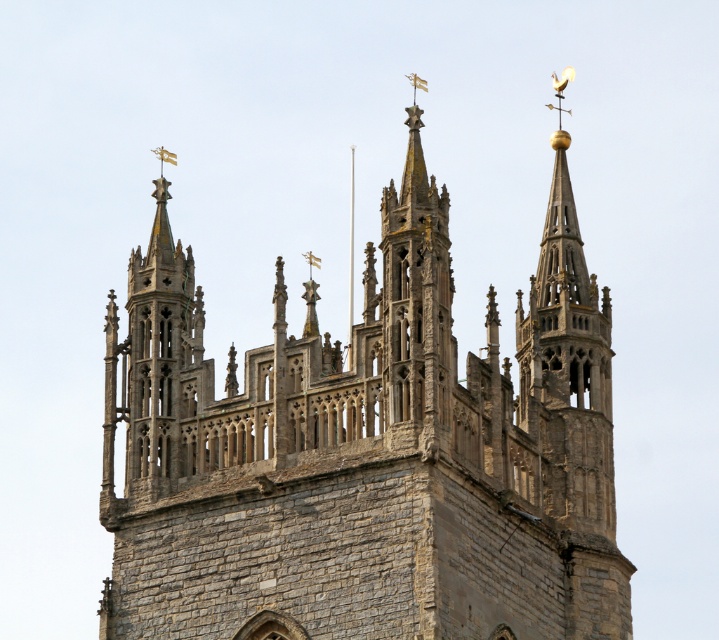
Question: Can you confirm if gray stone church at center is wider than stone spire at upper left?

Choices:
 (A) no
 (B) yes

Answer: (B)

Question: Which point is closer to the camera?

Choices:
 (A) (150, 253)
 (B) (535, 310)

Answer: (A)

Question: Does gray stone church at center appear on the right side of stone spire at upper left?

Choices:
 (A) no
 (B) yes

Answer: (B)

Question: Which object is positioned farthest from the gray stone church at center?

Choices:
 (A) stone spire at upper left
 (B) gold polished spire at upper center

Answer: (B)

Question: Which point is closer to the camera?

Choices:
 (A) (105, 380)
 (B) (165, 593)
 (C) (582, 454)

Answer: (B)

Question: Does gray stone church at center have a smaller size compared to gold polished spire at upper center?

Choices:
 (A) yes
 (B) no

Answer: (B)